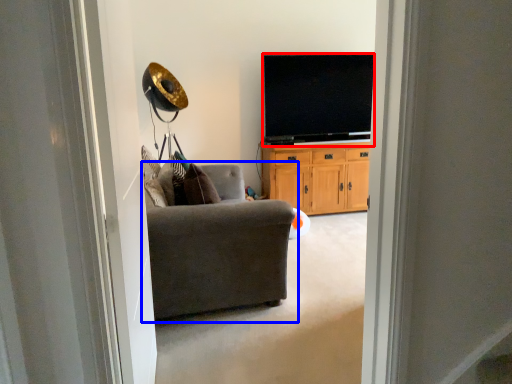
Question: Which object is further to the camera taking this photo, television (highlighted by a red box) or chair (highlighted by a blue box)?

Choices:
 (A) television
 (B) chair

Answer: (A)